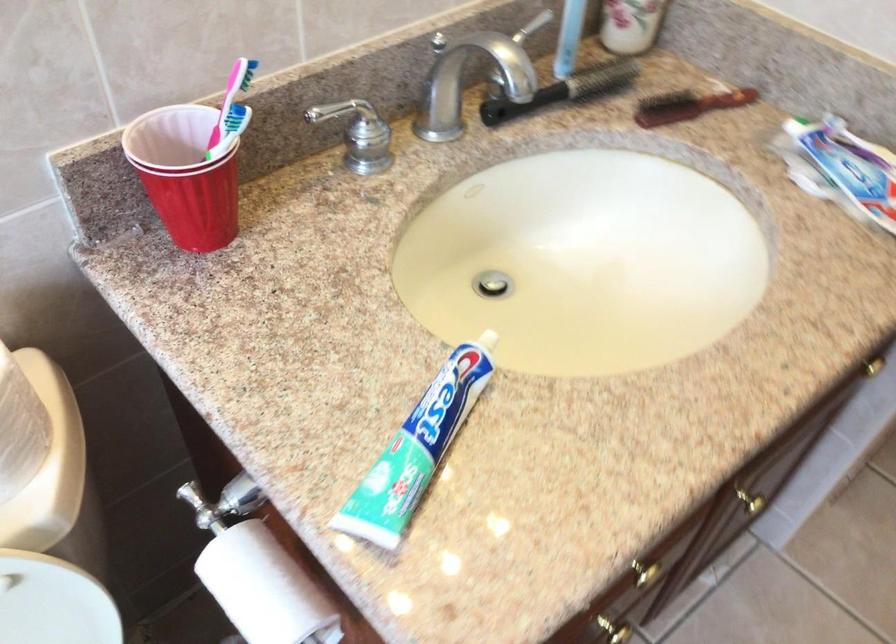
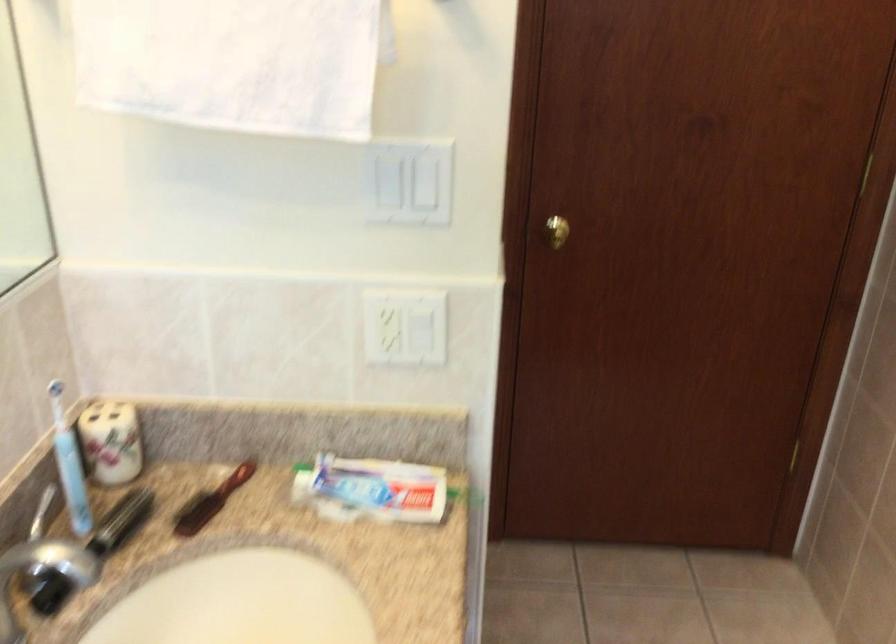
Question: The camera is either moving clockwise (left) or counter-clockwise (right) around the object. The first image is from the beginning of the video and the second image is from the end. Is the camera moving left or right when shooting the video?

Choices:
 (A) Left
 (B) Right

Answer: (A)